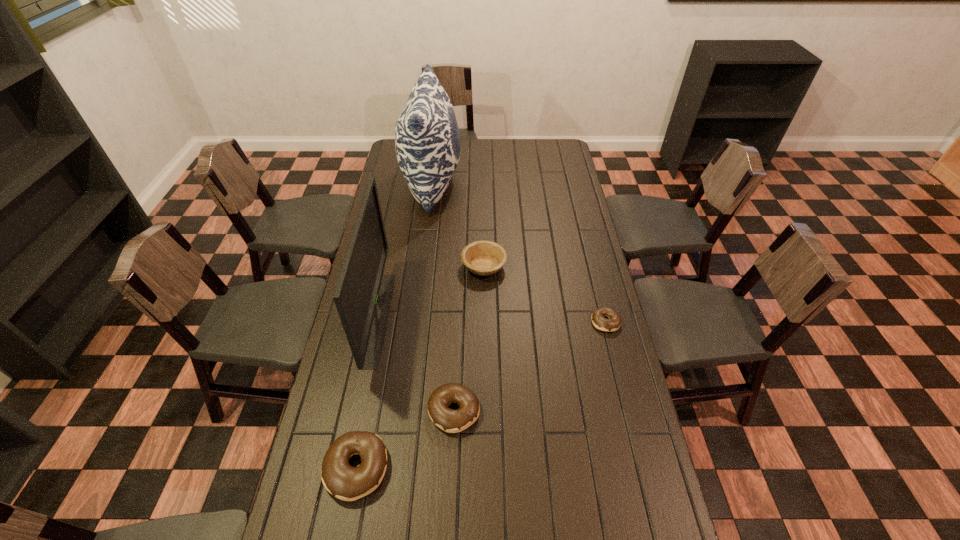
Where is `object that is at the right edge`? object that is at the right edge is located at coordinates (599, 321).

Find the location of a particular element. object located at the far left corner is located at coordinates (427, 140).

This screenshot has height=540, width=960. I want to click on object located at the near left corner, so click(x=343, y=481).

Find the location of a particular element. This screenshot has height=540, width=960. free space at the far edge of the desktop is located at coordinates (527, 160).

In the image, there is a desktop. Identify the location of vacant space at the near edge. The image size is (960, 540). (575, 500).

Where is `vacant space at the left edge of the desktop`? This screenshot has width=960, height=540. vacant space at the left edge of the desktop is located at coordinates (396, 264).

Identify the location of free space at the right edge of the desktop. (563, 164).

Find the location of a particular element. The height and width of the screenshot is (540, 960). empty location between the shortest doughnut and the second doughnut from right to left is located at coordinates (530, 366).

The image size is (960, 540). I want to click on vacant space in between the farthest doughnut and the bowl, so click(x=544, y=294).

Identify the location of free space between the leftmost doughnut and the bowl. The width and height of the screenshot is (960, 540). (420, 367).